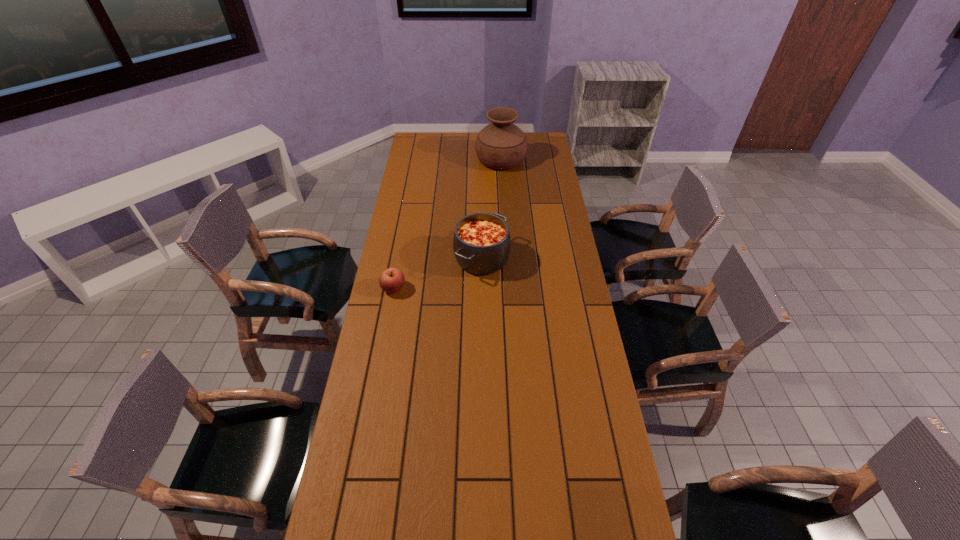
Locate an element on the screen. This screenshot has height=540, width=960. the tallest object is located at coordinates (501, 145).

The width and height of the screenshot is (960, 540). In order to click on the farthest object in this screenshot , I will do `click(501, 145)`.

You are a GUI agent. You are given a task and a screenshot of the screen. Output one action in this format:
    pyautogui.click(x=<x>, y=<y>)
    Task: Click on the casserole
    
    Given the screenshot: What is the action you would take?
    pyautogui.click(x=481, y=242)

Where is `the shortest object`? Image resolution: width=960 pixels, height=540 pixels. the shortest object is located at coordinates (392, 280).

Image resolution: width=960 pixels, height=540 pixels. Identify the location of the leftmost object. (392, 280).

Where is `vacant space located 0.270m on the front of the tallest object`? The image size is (960, 540). vacant space located 0.270m on the front of the tallest object is located at coordinates (504, 206).

What are the coordinates of `vacant space located on the right of the second shortest object` in the screenshot? It's located at (541, 259).

At what (x,y) coordinates should I click in order to perform the action: click on free space located 0.230m on the right of the leftmost object. Please return your answer as a coordinate pair (x, y). Looking at the image, I should click on (466, 288).

The image size is (960, 540). I want to click on object that is at the far edge, so click(501, 145).

At what (x,y) coordinates should I click in order to perform the action: click on object that is at the left edge. Please return your answer as a coordinate pair (x, y). Looking at the image, I should click on (392, 280).